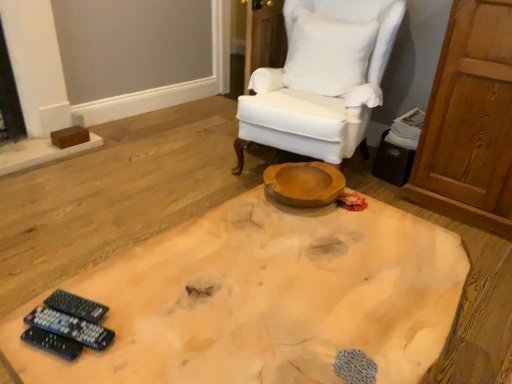
Question: Is black plastic remote controls at lower left, arranged as the 1th remote control when viewed from the front, wider or thinner than white fabric chair at upper center?

Choices:
 (A) wide
 (B) thin

Answer: (B)

Question: Is black plastic remote controls at lower left, which ranks as the 3th remote control in back-to-front order, spatially inside white fabric chair at upper center, or outside of it?

Choices:
 (A) outside
 (B) inside

Answer: (A)

Question: Considering the real-world distances, which object is farthest from the black plastic remote controls at lower left, which ranks as the 3th remote control in back-to-front order?

Choices:
 (A) white fabric chair at upper center
 (B) black plastic remote controls at lower left, the 3th remote control positioned from the front
 (C) natural wood coffee table at center
 (D) black plastic remote controls at lower left, the 2th remote control viewed from the back
 (E) white cotton pillow at upper right

Answer: (E)

Question: Which object is the closest to the natural wood coffee table at center?

Choices:
 (A) white cotton pillow at upper right
 (B) black plastic remote controls at lower left, the 3th remote control positioned from the front
 (C) white fabric chair at upper center
 (D) black plastic remote controls at lower left, which is counted as the 2th remote control, starting from the front
 (E) black plastic remote controls at lower left, arranged as the 1th remote control when viewed from the front

Answer: (D)